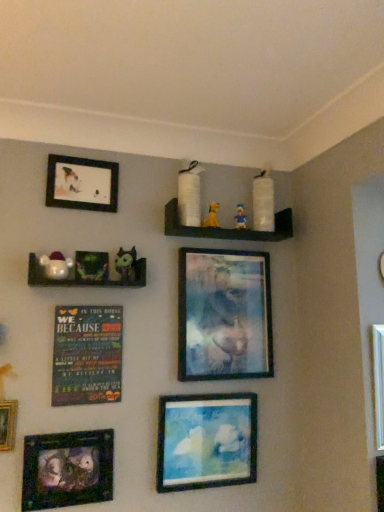
Question: From a real-world perspective, is yellow fabric dog at upper center, the 2th toy viewed from the back, positioned under metallic silver frame at center, placed as the second picture frame when sorted from right to left, based on gravity?

Choices:
 (A) no
 (B) yes

Answer: (A)

Question: From the image's perspective, is yellow fabric dog at upper center, which appears as the 3th toy when viewed from the front, on top of metallic silver frame at center, marked as the fourth picture frame in a left-to-right arrangement?

Choices:
 (A) yes
 (B) no

Answer: (A)

Question: Is yellow fabric dog at upper center, the 2th toy viewed from the back, oriented away from metallic silver frame at center, placed as the second picture frame when sorted from right to left?

Choices:
 (A) no
 (B) yes

Answer: (A)

Question: Is yellow fabric dog at upper center, which appears as the 3th toy when viewed from the front, next to metallic silver frame at center, marked as the fourth picture frame in a left-to-right arrangement?

Choices:
 (A) yes
 (B) no

Answer: (B)

Question: From the image's perspective, is yellow fabric dog at upper center, marked as the 2th toy in a right-to-left arrangement, located beneath metallic silver frame at center, placed as the second picture frame when sorted from right to left?

Choices:
 (A) yes
 (B) no

Answer: (B)

Question: Is point (380, 401) positioned closer to the camera than point (69, 259)?

Choices:
 (A) farther
 (B) closer

Answer: (B)

Question: Looking at the image, does metallic silver picture frame at upper center, acting as the first picture frame starting from the right, seem bigger or smaller compared to white glossy plush toy at left, the fourth toy positioned from the right?

Choices:
 (A) small
 (B) big

Answer: (B)

Question: In terms of width, does metallic silver picture frame at upper center, acting as the first picture frame starting from the right, look wider or thinner when compared to white glossy plush toy at left, the first toy positioned from the left?

Choices:
 (A) thin
 (B) wide

Answer: (A)

Question: In the image, is metallic silver picture frame at upper center, acting as the first picture frame starting from the right, positioned in front of or behind white glossy plush toy at left, marked as the 4th toy in a back-to-front arrangement?

Choices:
 (A) front
 (B) behind

Answer: (A)

Question: Visually, is multicolored wooden plaque at center-left positioned to the left or to the right of metallic silver frame at center, marked as the fourth picture frame in a left-to-right arrangement?

Choices:
 (A) left
 (B) right

Answer: (A)

Question: Considering the positions of multicolored wooden plaque at center-left and metallic silver frame at center, marked as the fourth picture frame in a left-to-right arrangement, in the image, is multicolored wooden plaque at center-left wider or thinner than metallic silver frame at center, marked as the fourth picture frame in a left-to-right arrangement,?

Choices:
 (A) thin
 (B) wide

Answer: (A)

Question: From a real-world perspective, is multicolored wooden plaque at center-left positioned above or below metallic silver frame at center, marked as the fourth picture frame in a left-to-right arrangement?

Choices:
 (A) above
 (B) below

Answer: (B)

Question: Looking at the image, does multicolored wooden plaque at center-left seem bigger or smaller compared to metallic silver frame at center, placed as the second picture frame when sorted from right to left?

Choices:
 (A) big
 (B) small

Answer: (B)

Question: In terms of height, does green rubber donut at upper center, arranged as the third toy when viewed from the right, look taller or shorter compared to yellow fabric dog at upper center, marked as the 2th toy in a right-to-left arrangement?

Choices:
 (A) short
 (B) tall

Answer: (B)

Question: Would you say green rubber donut at upper center, which is the third toy from back to front, is inside or outside yellow fabric dog at upper center, positioned as the third toy in left-to-right order?

Choices:
 (A) inside
 (B) outside

Answer: (B)